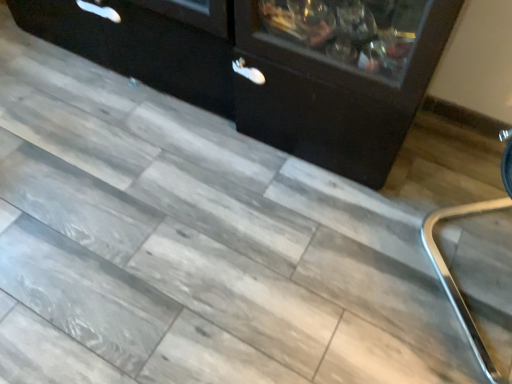
What do you see at coordinates (448, 268) in the screenshot?
I see `metallic silver chair at right` at bounding box center [448, 268].

Consider the image. Measure the distance between point (x=487, y=356) and camera.

Point (x=487, y=356) is 4.05 feet away from camera.

This screenshot has width=512, height=384. I want to click on metallic silver chair at right, so click(x=448, y=268).

Identify the location of metallic silver chair at right. The image size is (512, 384). (448, 268).